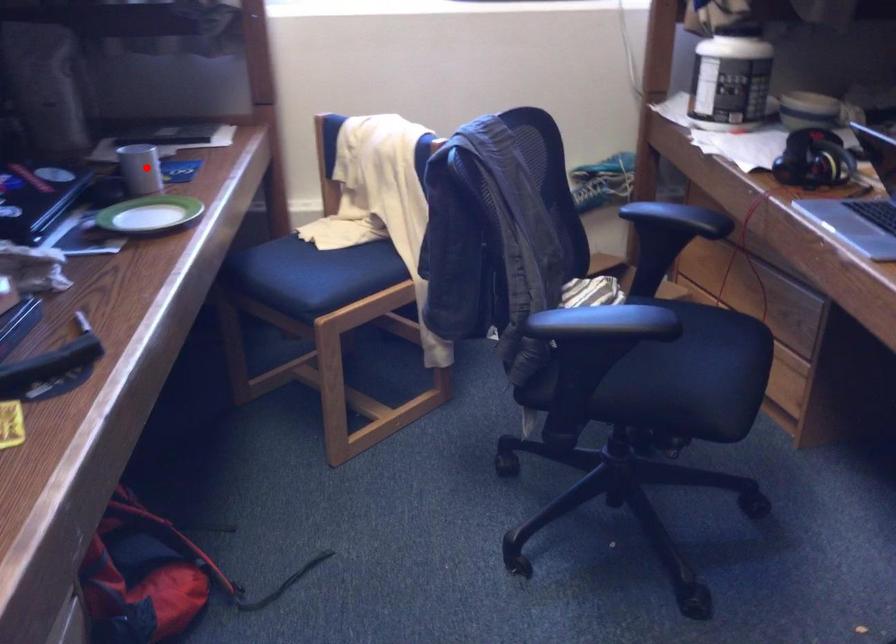
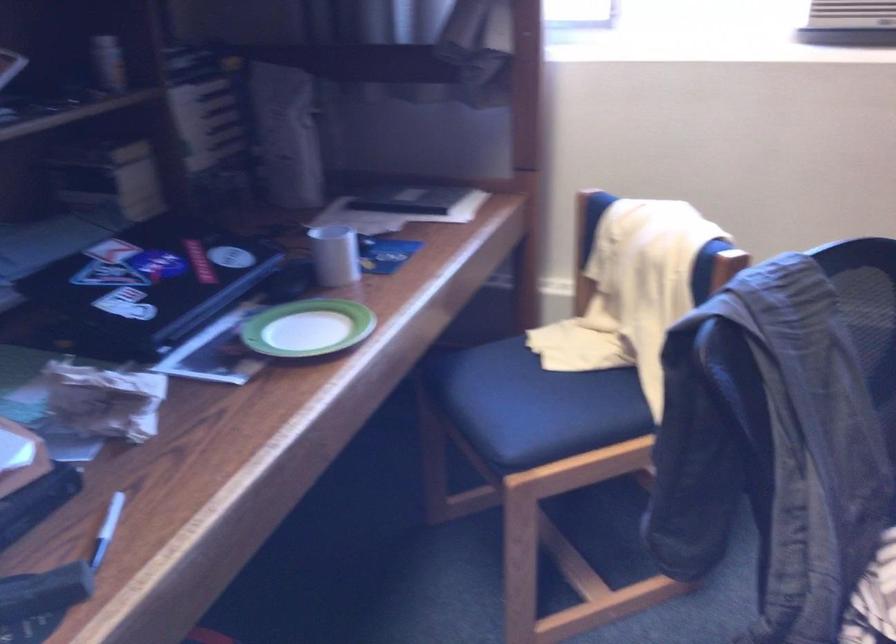
Question: I am providing you with two images of the same scene from different viewpoints. In image1, a red point is highlighted. Considering the same 3D point in image2, which of the following is correct?

Choices:
 (A) It is closer
 (B) It is farther

Answer: (A)